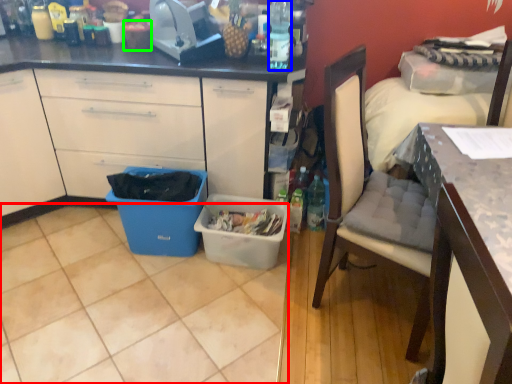
Question: Which object is the farthest from tile (highlighted by a red box)? Choose among these: bottle (highlighted by a blue box) or coffee cup (highlighted by a green box).

Choices:
 (A) bottle
 (B) coffee cup

Answer: (B)